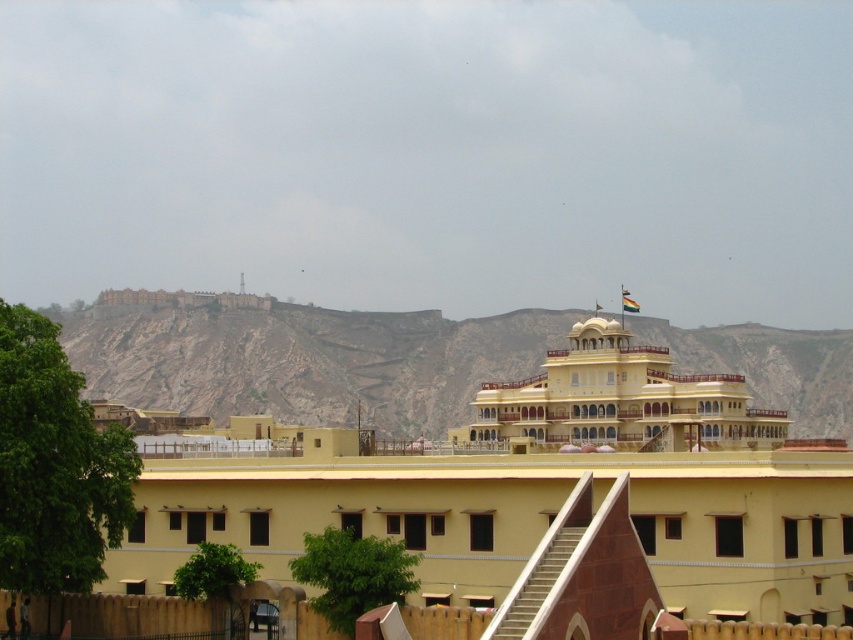
You are standing at the base of the brown rocky mountain at upper left and want to reach the entrance of the matte yellow building at center. According to the scene description, which direction should you head towards?

The brown rocky mountain at upper left is located below the matte yellow building at center, so you should head downwards towards the matte yellow building at center to reach its entrance.